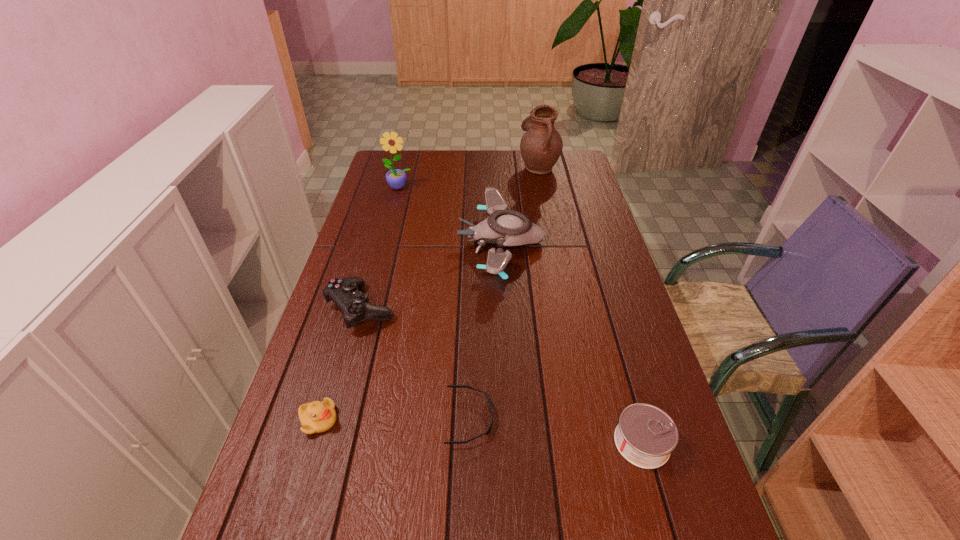
At what (x,y) coordinates should I click in order to perform the action: click on the farthest object. Please return your answer as a coordinate pair (x, y). Looking at the image, I should click on (541, 145).

Image resolution: width=960 pixels, height=540 pixels. In order to click on sunflower in this screenshot , I will do `click(396, 178)`.

The image size is (960, 540). Identify the location of drone. (504, 227).

Locate an element on the screen. The image size is (960, 540). control is located at coordinates (354, 304).

Where is `duckling`? duckling is located at coordinates (315, 417).

Find the location of a particular element. The width and height of the screenshot is (960, 540). can is located at coordinates (645, 436).

The height and width of the screenshot is (540, 960). What are the coordinates of `sunglasses` in the screenshot? It's located at (488, 430).

Find the location of a particular element. This screenshot has height=540, width=960. vacant space located at the spout of the pitcher is located at coordinates (437, 167).

Identify the location of vacant space located at the spout of the pitcher. point(439,167).

Where is `free space located 0.110m at the spout of the pitcher`? The height and width of the screenshot is (540, 960). free space located 0.110m at the spout of the pitcher is located at coordinates (492, 167).